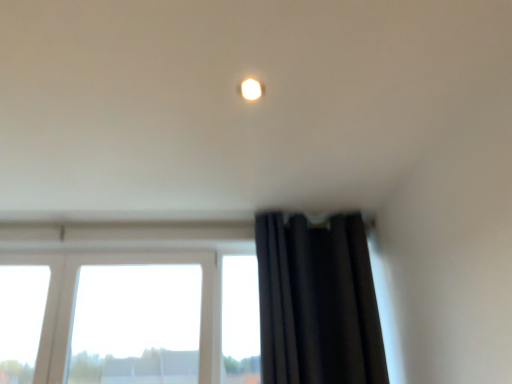
Question: Considering the positions of point (253, 89) and point (331, 322), is point (253, 89) closer or farther from the camera than point (331, 322)?

Choices:
 (A) closer
 (B) farther

Answer: (A)

Question: From the image's perspective, is matte white light fixture at upper center positioned above or below black velvet curtain at right?

Choices:
 (A) above
 (B) below

Answer: (A)

Question: Looking at the image, does matte white light fixture at upper center seem bigger or smaller compared to black velvet curtain at right?

Choices:
 (A) small
 (B) big

Answer: (A)

Question: From a real-world perspective, is black velvet curtain at right physically located above or below matte white light fixture at upper center?

Choices:
 (A) above
 (B) below

Answer: (B)

Question: From the image's perspective, is black velvet curtain at right above or below matte white light fixture at upper center?

Choices:
 (A) below
 (B) above

Answer: (A)

Question: Is black velvet curtain at right situated inside matte white light fixture at upper center or outside?

Choices:
 (A) inside
 (B) outside

Answer: (B)

Question: Considering the relative positions of black velvet curtain at right and matte white light fixture at upper center in the image provided, is black velvet curtain at right to the left or to the right of matte white light fixture at upper center?

Choices:
 (A) right
 (B) left

Answer: (A)